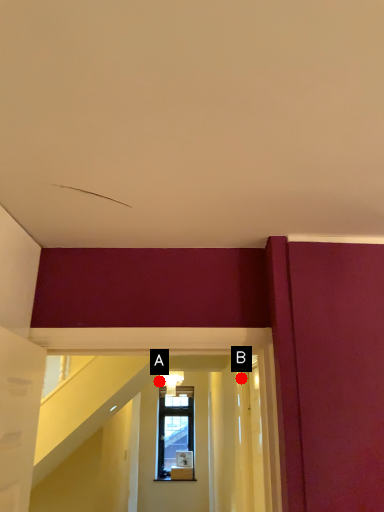
Question: Two points are circled on the image, labeled by A and B beside each circle. Which point is further to the camera?

Choices:
 (A) A is further
 (B) B is further

Answer: (A)